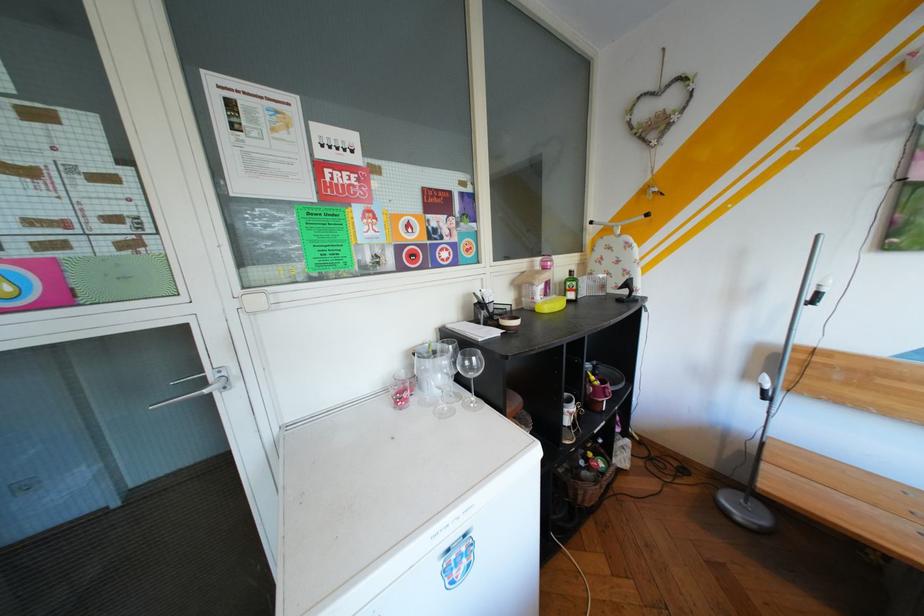
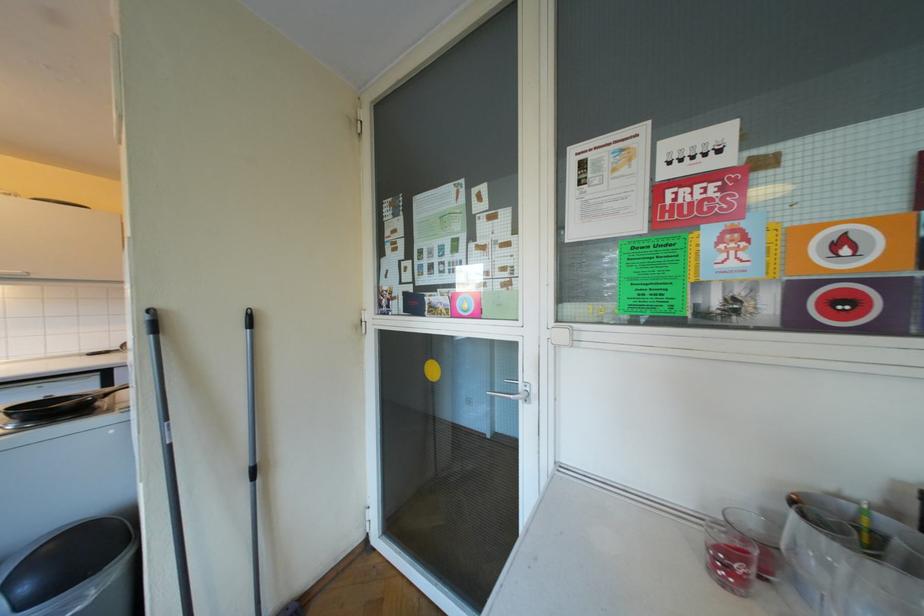
The point at (418, 394) is marked in the first image. Where is the corresponding point in the second image?

(752, 567)